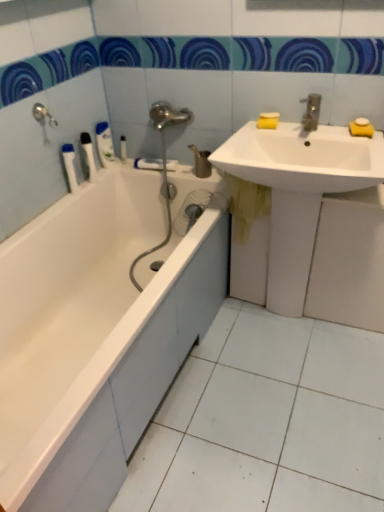
This screenshot has width=384, height=512. I want to click on spots to the right of white plastic toilet brush at upper left, positioned as the 3th toiletry in left-to-right order, so pyautogui.click(x=135, y=165).